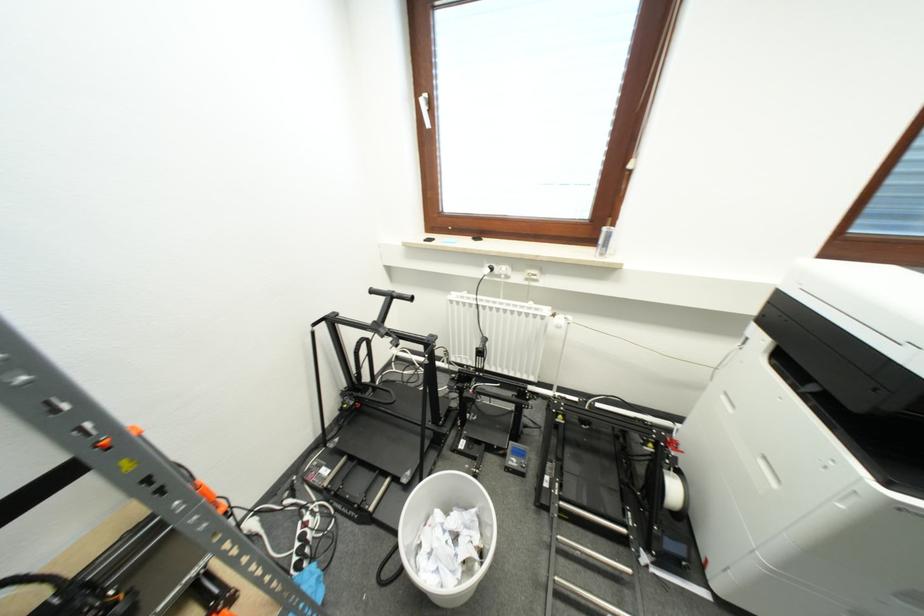
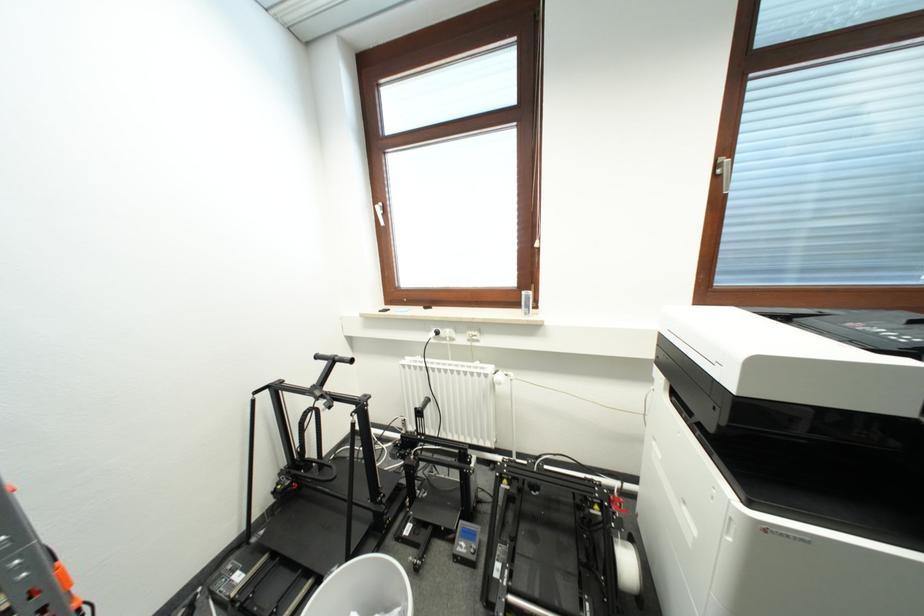
Locate, in the second image, the point that corresponds to point 377,294 in the first image.

(322, 360)